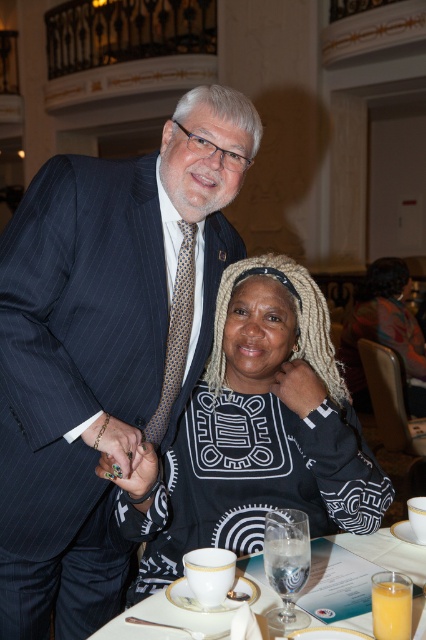
You are an event planner arranging seating for a dinner. You need to place a name tag on the table in front of the pinstriped suit at upper left and the black textured sweater at center. Which name tag should be placed closer to the edge of the table?

The name tag for the pinstriped suit at upper left should be placed closer to the edge of the table because it is positioned under the black textured sweater at center, indicating it is closer to the table edge.

You are a photographer setting up for a formal event. You have two outfits to photograph, the pinstriped suit at upper left and the black matte sweater at center. Based on the scene, which outfit is narrower in width?

The pinstriped suit at upper left is thinner than the black matte sweater at center, so the pinstriped suit at upper left is narrower in width.